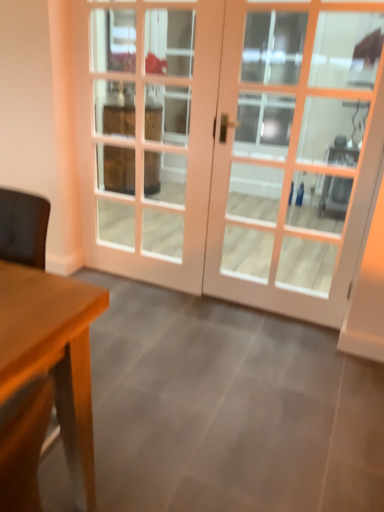
Question: Can you confirm if white glass screen door at center is shorter than white wooden door at center?

Choices:
 (A) yes
 (B) no

Answer: (B)

Question: From the image's perspective, does white glass screen door at center appear lower than white wooden door at center?

Choices:
 (A) yes
 (B) no

Answer: (B)

Question: From the image's perspective, is white glass screen door at center located above white wooden door at center?

Choices:
 (A) yes
 (B) no

Answer: (A)

Question: Considering the relative positions of white glass screen door at center and white wooden door at center in the image provided, is white glass screen door at center to the left of white wooden door at center from the viewer's perspective?

Choices:
 (A) yes
 (B) no

Answer: (A)

Question: Is white glass screen door at center closer to the viewer compared to white wooden door at center?

Choices:
 (A) yes
 (B) no

Answer: (B)

Question: From a real-world perspective, is white glass screen door at center physically above white wooden door at center?

Choices:
 (A) yes
 (B) no

Answer: (B)

Question: Does white wooden door at center have a smaller size compared to white glass screen door at center?

Choices:
 (A) yes
 (B) no

Answer: (B)

Question: Would you say white wooden door at center is outside white glass screen door at center?

Choices:
 (A) yes
 (B) no

Answer: (A)

Question: From a real-world perspective, does white wooden door at center stand above white glass screen door at center?

Choices:
 (A) yes
 (B) no

Answer: (A)

Question: Considering the relative sizes of white wooden door at center and white glass screen door at center in the image provided, is white wooden door at center bigger than white glass screen door at center?

Choices:
 (A) no
 (B) yes

Answer: (B)

Question: From the image's perspective, is white wooden door at center located beneath white glass screen door at center?

Choices:
 (A) yes
 (B) no

Answer: (A)

Question: Does white wooden door at center contain white glass screen door at center?

Choices:
 (A) yes
 (B) no

Answer: (A)

Question: Considering the positions of white wooden door at center and white glass screen door at center in the image, is white wooden door at center wider or thinner than white glass screen door at center?

Choices:
 (A) wide
 (B) thin

Answer: (A)